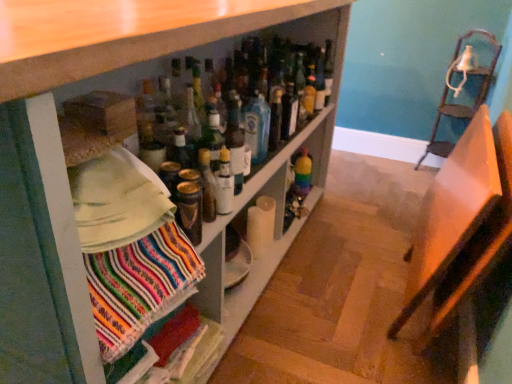
Describe the element at coordinates (458, 104) in the screenshot. The height and width of the screenshot is (384, 512). I see `metallic silver chair at upper right, which is counted as the first chair, starting from the back` at that location.

How much space does metallic silver chair at upper right, marked as the second chair in a front-to-back arrangement, occupy vertically?

The height of metallic silver chair at upper right, marked as the second chair in a front-to-back arrangement, is 36.86 inches.

At what (x,y) coordinates should I click in order to perform the action: click on rainbow glass bottle at center, which is the first bottle from right to left. Please return your answer as a coordinate pair (x, y). Looking at the image, I should click on (302, 174).

I want to click on blue glass bottle at center, so click(257, 126).

What do you see at coordinates (189, 210) in the screenshot? This screenshot has width=512, height=384. I see `metallic gold can at center, which ranks as the 4th bottle in back-to-front order` at bounding box center [189, 210].

Where is `metallic gold can at center, which is the fourth bottle in right-to-left order`? Image resolution: width=512 pixels, height=384 pixels. metallic gold can at center, which is the fourth bottle in right-to-left order is located at coordinates (189, 210).

What do you see at coordinates (461, 224) in the screenshot? I see `wooden chair at right, the second chair positioned from the right` at bounding box center [461, 224].

Find the location of `clear glass bottle at center, which is counted as the second bottle, starting from the front`. clear glass bottle at center, which is counted as the second bottle, starting from the front is located at coordinates (224, 184).

Locate an element on the screen. This screenshot has width=512, height=384. black glass bottle at center, acting as the third bottle starting from the left is located at coordinates (289, 111).

Is matte white shelf at center positioned with its back to black glass bottle at center, which appears as the 3th bottle when viewed from the front?

Yes, matte white shelf at center is positioned with its back facing black glass bottle at center, which appears as the 3th bottle when viewed from the front.

I want to click on shelf below the black glass bottle at center, placed as the 2th bottle when sorted from right to left (from a real-world perspective), so coord(63,156).

From the image's perspective, is matte white shelf at center located above or below black glass bottle at center, which appears as the 3th bottle when viewed from the front?

From the image's perspective, matte white shelf at center appears below black glass bottle at center, which appears as the 3th bottle when viewed from the front.

Considering the relative sizes of matte white shelf at center and black glass bottle at center, which appears as the 3th bottle when viewed from the front, in the image provided, is matte white shelf at center bigger than black glass bottle at center, which appears as the 3th bottle when viewed from the front,?

Indeed, matte white shelf at center has a larger size compared to black glass bottle at center, which appears as the 3th bottle when viewed from the front.

Can you tell me how much blue glass bottle at center and matte white shelf at center differ in facing direction?

1.36 degrees separate the facing orientations of blue glass bottle at center and matte white shelf at center.

Do you think blue glass bottle at center is within matte white shelf at center, or outside of it?

blue glass bottle at center is enclosed within matte white shelf at center.

From the picture: Looking at their sizes, would you say blue glass bottle at center is wider or thinner than matte white shelf at center?

Clearly, blue glass bottle at center has less width compared to matte white shelf at center.

From the image's perspective, which one is positioned lower, blue glass bottle at center or matte white shelf at center?

matte white shelf at center appears lower in the image.

Considering the relative positions of blue glass bottle at center and black glass bottle at center, which appears as the 3th bottle when viewed from the front, in the image provided, is blue glass bottle at center to the right of black glass bottle at center, which appears as the 3th bottle when viewed from the front, from the viewer's perspective?

In fact, blue glass bottle at center is to the left of black glass bottle at center, which appears as the 3th bottle when viewed from the front.

Between blue glass bottle at center and black glass bottle at center, placed as the 2th bottle when sorted from right to left, which one has smaller width?

Thinner between the two is blue glass bottle at center.

Is blue glass bottle at center in contact with black glass bottle at center, which appears as the 3th bottle when viewed from the front?

No, blue glass bottle at center is not beside black glass bottle at center, which appears as the 3th bottle when viewed from the front.

From a real-world perspective, which is physically below, blue glass bottle at center or black glass bottle at center, which ranks as the second bottle in back-to-front order?

black glass bottle at center, which ranks as the second bottle in back-to-front order, from a real-world perspective.

From the image's perspective, would you say clear glass bottle at center, acting as the third bottle starting from the back, is shown under multicolored woven cloth at lower left?

No.

Would you say clear glass bottle at center, which is counted as the second bottle, starting from the front, is outside multicolored woven cloth at lower left?

That's correct, clear glass bottle at center, which is counted as the second bottle, starting from the front, is outside of multicolored woven cloth at lower left.

Who is taller, clear glass bottle at center, which is the second bottle from left to right, or multicolored woven cloth at lower left?

clear glass bottle at center, which is the second bottle from left to right.

Is clear glass bottle at center, which is counted as the second bottle, starting from the front, directly adjacent to multicolored woven cloth at lower left?

No, clear glass bottle at center, which is counted as the second bottle, starting from the front, is not with multicolored woven cloth at lower left.

Who is shorter, rainbow glass bottle at center, which is the first bottle from right to left, or metallic silver chair at upper right, the first chair in the right-to-left sequence?

rainbow glass bottle at center, which is the first bottle from right to left, is shorter.

From a real-world perspective, which is physically below, rainbow glass bottle at center, the first bottle in the back-to-front sequence, or metallic silver chair at upper right, which is the 2th chair from left to right?

rainbow glass bottle at center, the first bottle in the back-to-front sequence, from a real-world perspective.

From the image's perspective, is rainbow glass bottle at center, arranged as the 4th bottle when viewed from the left, above metallic silver chair at upper right, which is the 2th chair from left to right?

No, from the image's perspective, rainbow glass bottle at center, arranged as the 4th bottle when viewed from the left, is not on top of metallic silver chair at upper right, which is the 2th chair from left to right.

Which is behind, point (297, 173) or point (452, 105)?

Positioned behind is point (452, 105).

Which of these two, metallic gold can at center, which is counted as the first bottle, starting from the left, or black glass bottle at center, placed as the 2th bottle when sorted from right to left, is wider?

Wider between the two is black glass bottle at center, placed as the 2th bottle when sorted from right to left.

Based on the photo, from a real-world perspective, which is physically below, metallic gold can at center, which is counted as the 1th bottle, starting from the front, or black glass bottle at center, which appears as the 3th bottle when viewed from the front?

metallic gold can at center, which is counted as the 1th bottle, starting from the front.

Between metallic gold can at center, which is counted as the 1th bottle, starting from the front, and black glass bottle at center, which ranks as the second bottle in back-to-front order, which one has smaller size?

metallic gold can at center, which is counted as the 1th bottle, starting from the front, is smaller.

Considering the sizes of objects metallic gold can at center, which is the fourth bottle in right-to-left order, and black glass bottle at center, placed as the 2th bottle when sorted from right to left, in the image provided, who is taller, metallic gold can at center, which is the fourth bottle in right-to-left order, or black glass bottle at center, placed as the 2th bottle when sorted from right to left,?

black glass bottle at center, placed as the 2th bottle when sorted from right to left, is taller.

Can we say rainbow glass bottle at center, the first bottle in the back-to-front sequence, lies outside blue glass bottle at center?

Indeed, rainbow glass bottle at center, the first bottle in the back-to-front sequence, is completely outside blue glass bottle at center.

From a real-world perspective, which is physically below, rainbow glass bottle at center, which is the first bottle from right to left, or blue glass bottle at center?

In real-world perspective, rainbow glass bottle at center, which is the first bottle from right to left, is lower.

From the image's perspective, would you say rainbow glass bottle at center, the first bottle in the back-to-front sequence, is positioned over blue glass bottle at center?

Actually, rainbow glass bottle at center, the first bottle in the back-to-front sequence, appears below blue glass bottle at center in the image.

Is rainbow glass bottle at center, arranged as the 4th bottle when viewed from the left, aimed at blue glass bottle at center?

No.

Identify the location of shelf lying in front of the black glass bottle at center, placed as the 2th bottle when sorted from right to left. (63, 156).

The image size is (512, 384). Find the location of `beverage above the matte white shelf at center (from the image's perspective)`. beverage above the matte white shelf at center (from the image's perspective) is located at coordinates (257, 126).

Considering their positions, is wooden chair at right, the first chair when ordered from front to back, positioned further to blue glass bottle at center than rainbow glass bottle at center, the first bottle in the back-to-front sequence?

wooden chair at right, the first chair when ordered from front to back, is further to blue glass bottle at center.

In the scene shown: From the image, which object appears to be farther from metallic silver chair at upper right, the first chair in the right-to-left sequence, matte white shelf at center or black glass bottle at center, acting as the third bottle starting from the left?

matte white shelf at center.

Which object lies further to the anchor point rainbow glass bottle at center, arranged as the 4th bottle when viewed from the left, black glass bottle at center, placed as the 2th bottle when sorted from right to left, or clear glass bottle at center, which appears as the 3th bottle when viewed from the right?

clear glass bottle at center, which appears as the 3th bottle when viewed from the right.

From the image, which object appears to be farther from metallic silver chair at upper right, which is counted as the first chair, starting from the back, wooden chair at right, the 2th chair viewed from the back, or clear glass bottle at center, which is counted as the second bottle, starting from the front?

clear glass bottle at center, which is counted as the second bottle, starting from the front.

Considering their positions, is metallic silver chair at upper right, which is the 2th chair from left to right, positioned further to metallic gold can at center, which is counted as the 1th bottle, starting from the front, than blue glass bottle at center?

metallic silver chair at upper right, which is the 2th chair from left to right.

When comparing their distances from metallic gold can at center, which is counted as the first bottle, starting from the left, does wooden chair at right, the 2th chair viewed from the back, or multicolored woven cloth at lower left seem further?

wooden chair at right, the 2th chair viewed from the back, is further to metallic gold can at center, which is counted as the first bottle, starting from the left.

Which object lies nearer to the anchor point clear glass bottle at center, acting as the third bottle starting from the back, blue glass bottle at center or matte white shelf at center?

blue glass bottle at center is positioned closer to the anchor clear glass bottle at center, acting as the third bottle starting from the back.

In the scene shown: Estimate the real-world distances between objects in this image. Which object is further from metallic gold can at center, which is counted as the 1th bottle, starting from the front, black glass bottle at center, placed as the 2th bottle when sorted from right to left, or blue glass bottle at center?

The object further to metallic gold can at center, which is counted as the 1th bottle, starting from the front, is black glass bottle at center, placed as the 2th bottle when sorted from right to left.

Where is `fabric between matte white shelf at center and metallic silver chair at upper right, which is counted as the first chair, starting from the back, along the z-axis`? fabric between matte white shelf at center and metallic silver chair at upper right, which is counted as the first chair, starting from the back, along the z-axis is located at coordinates (140, 286).

Where is `bottle between clear glass bottle at center, which appears as the 3th bottle when viewed from the right, and rainbow glass bottle at center, the 4th bottle viewed from the front, in the front-back direction`? This screenshot has width=512, height=384. bottle between clear glass bottle at center, which appears as the 3th bottle when viewed from the right, and rainbow glass bottle at center, the 4th bottle viewed from the front, in the front-back direction is located at coordinates click(x=289, y=111).

Image resolution: width=512 pixels, height=384 pixels. Find the location of `beverage between wooden chair at right, the 1th chair when ordered from left to right, and black glass bottle at center, which ranks as the second bottle in back-to-front order, along the z-axis`. beverage between wooden chair at right, the 1th chair when ordered from left to right, and black glass bottle at center, which ranks as the second bottle in back-to-front order, along the z-axis is located at coordinates (257, 126).

At what (x,y) coordinates should I click in order to perform the action: click on chair between multicolored woven cloth at lower left and metallic silver chair at upper right, marked as the second chair in a front-to-back arrangement, from front to back. Please return your answer as a coordinate pair (x, y). Looking at the image, I should click on (461, 224).